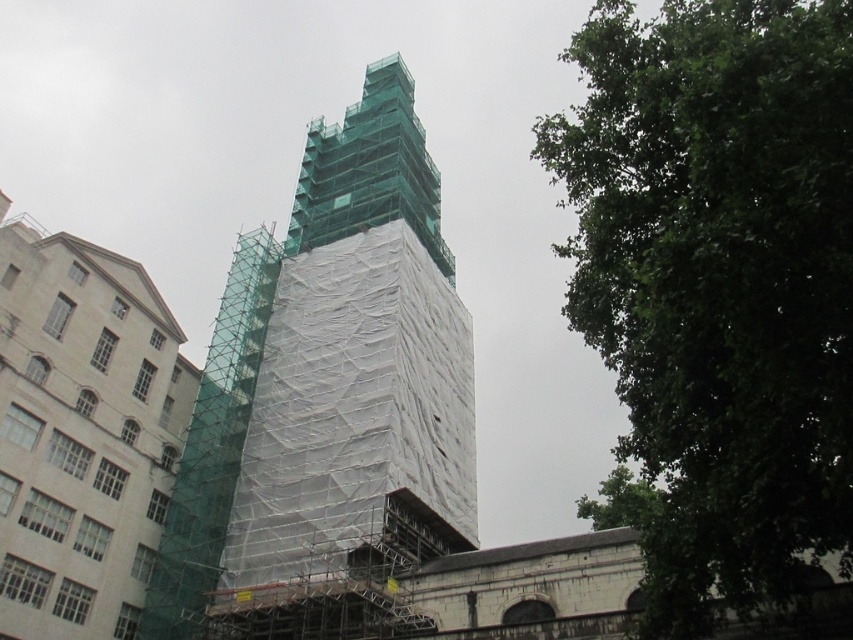
Question: Which point appears closest to the camera in this image?

Choices:
 (A) (316, 449)
 (B) (741, 384)

Answer: (B)

Question: Can you confirm if green leafy tree at upper right is bigger than green scaffolding at center?

Choices:
 (A) no
 (B) yes

Answer: (B)

Question: Does green leafy tree at upper right have a smaller size compared to green scaffolding at center?

Choices:
 (A) yes
 (B) no

Answer: (B)

Question: Does green leafy tree at upper right have a greater width compared to green scaffolding at center?

Choices:
 (A) yes
 (B) no

Answer: (A)